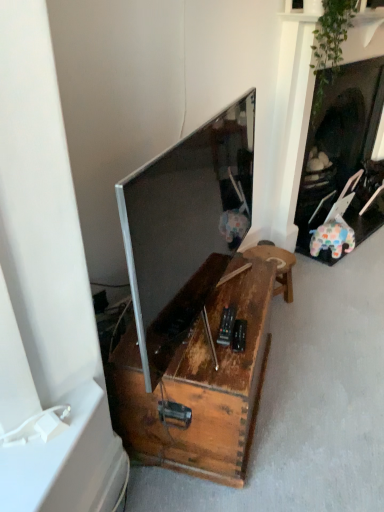
At what (x,y) coordinates should I click in order to perform the action: click on free point below satin silver television at center (from a real-world perspective). Please return your answer as a coordinate pair (x, y). The image size is (384, 512). Looking at the image, I should click on (212, 315).